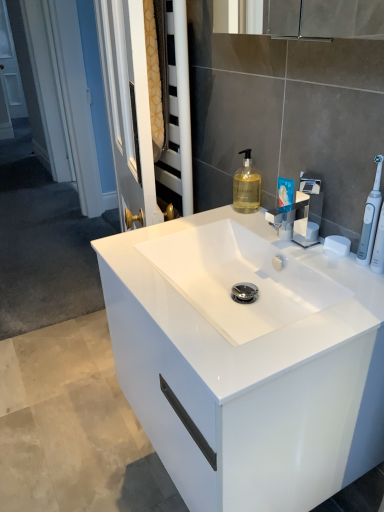
Question: From the image's perspective, is satin nickel faucet at center located above or below translucent yellow liquid at center?

Choices:
 (A) above
 (B) below

Answer: (B)

Question: Is point (271, 219) positioned closer to the camera than point (243, 176)?

Choices:
 (A) farther
 (B) closer

Answer: (A)

Question: Which is nearer to the white glossy cabinet at center?

Choices:
 (A) translucent yellow liquid at center
 (B) satin nickel faucet at center
 (C) white matte soap at upper right
 (D) white plastic toothbrush at right
 (E) blue glossy toothpaste tube at upper right

Answer: (B)

Question: Which object is the closest to the white matte soap at upper right?

Choices:
 (A) satin nickel faucet at center
 (B) blue glossy toothpaste tube at upper right
 (C) translucent yellow liquid at center
 (D) white glossy cabinet at center
 (E) white plastic toothbrush at right

Answer: (E)